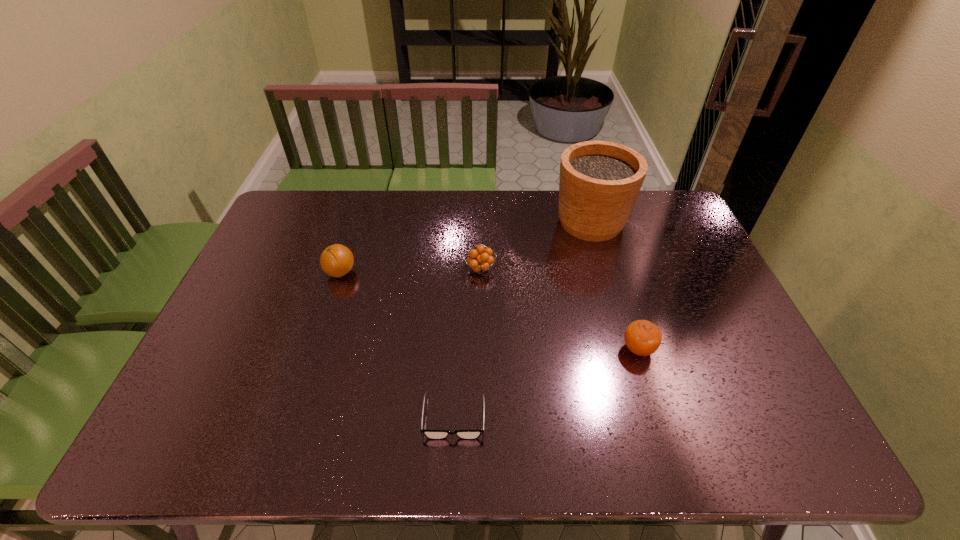
The image size is (960, 540). What are the coordinates of `vacant space at the far right corner of the desktop` in the screenshot? It's located at (652, 202).

At what (x,y) coordinates should I click in order to perform the action: click on empty space between the rightmost orange fruit and the farthest object. Please return your answer as a coordinate pair (x, y). Looking at the image, I should click on (614, 286).

I want to click on unoccupied position between the shortest object and the leftmost object, so click(397, 345).

Where is `empty space that is in between the farthest object and the nearest orange fruit`? The image size is (960, 540). empty space that is in between the farthest object and the nearest orange fruit is located at coordinates (614, 286).

Locate an element on the screen. vacant area between the rightmost orange fruit and the leftmost object is located at coordinates (490, 310).

Image resolution: width=960 pixels, height=540 pixels. Identify the location of empty space between the rightmost orange fruit and the leftmost object. (490, 310).

Identify the location of free space between the nearest orange fruit and the fourth tallest object. This screenshot has height=540, width=960. (559, 309).

You are a GUI agent. You are given a task and a screenshot of the screen. Output one action in this format:
    pyautogui.click(x=<x>, y=<y>)
    Task: Click on the free space between the nearest object and the shortest orange fruit
    This screenshot has height=540, width=960.
    Given the screenshot: What is the action you would take?
    pyautogui.click(x=467, y=343)

This screenshot has width=960, height=540. Find the location of `free space between the farthest object and the spectacles`. free space between the farthest object and the spectacles is located at coordinates 522,320.

Identify the location of vacant area that lies between the leftmost object and the second orange fruit from left to right. Image resolution: width=960 pixels, height=540 pixels. (410, 271).